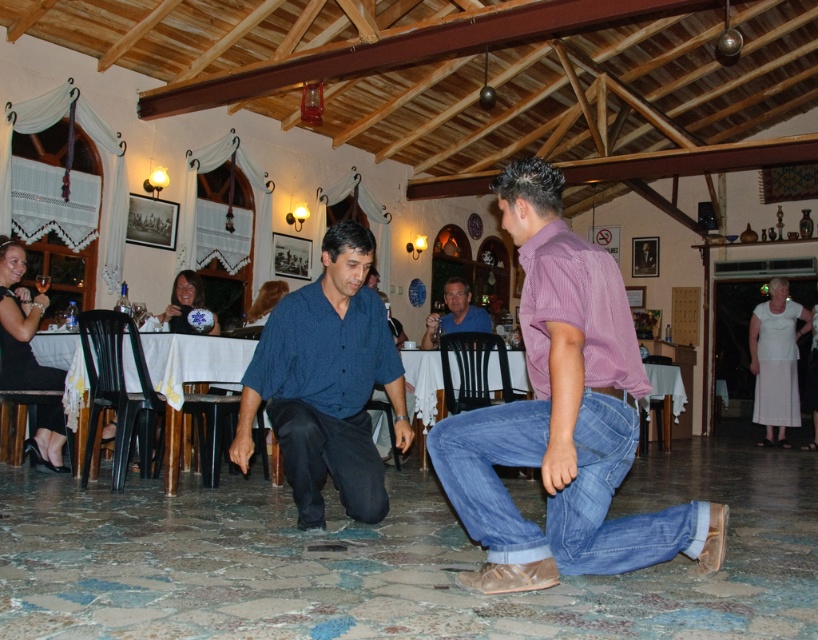
You are a photographer trying to capture both the pink striped shirt at center and the blue shirt at center in a single frame. Given their sizes, which shirt should you focus on to ensure both are clearly visible in the photo?

Since the pink striped shirt at center is larger than the blue shirt at center, you should focus on the pink striped shirt at center to ensure both are clearly visible in the photo.

You are a photographer trying to capture a candid shot of the dark blue shirt at center and the dark blue denim jeans at center. Since you want to ensure both are clearly visible in the frame, which object should you focus on to account for their sizes?

You should focus on the dark blue shirt at center because it is wider than the dark blue denim jeans at center, ensuring the larger object is in clear focus.

In the scene shown: You are a photographer standing at the entrance of the taverna. You want to take a photo that includes both the point at coordinates (349, 467) and the point at (459, 285). Which point should be placed closer to the front of the image to ensure both are in focus?

Point at coordinates (349, 467) should be placed closer to the front of the image because it is closer to the camera than point at coordinates (459, 285). This ensures both points are within the depth of field for better focus.